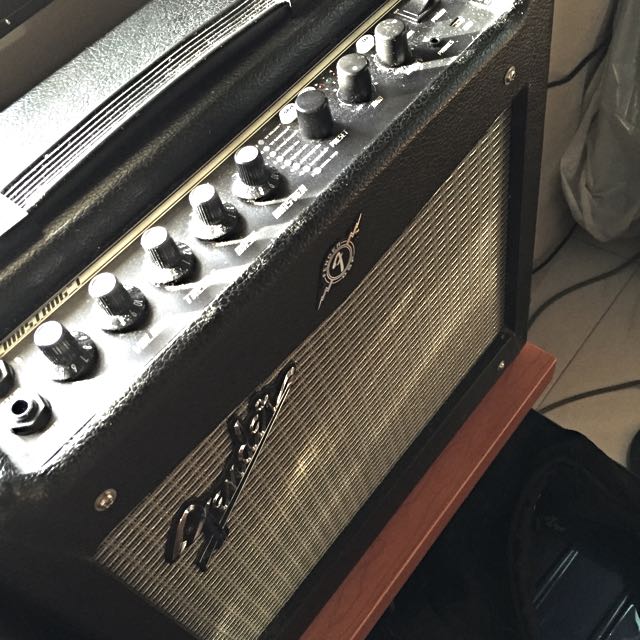
Image resolution: width=640 pixels, height=640 pixels. Identify the location of table. (428, 489).